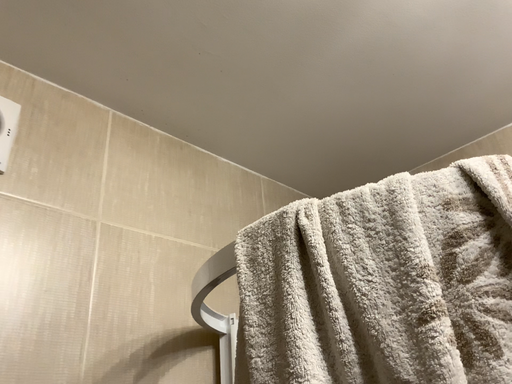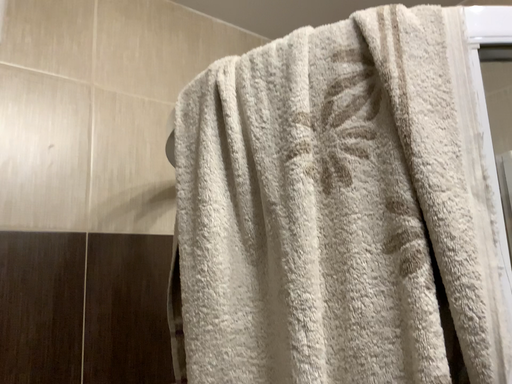
Question: Which way did the camera rotate in the video?

Choices:
 (A) rotated right
 (B) rotated left

Answer: (B)